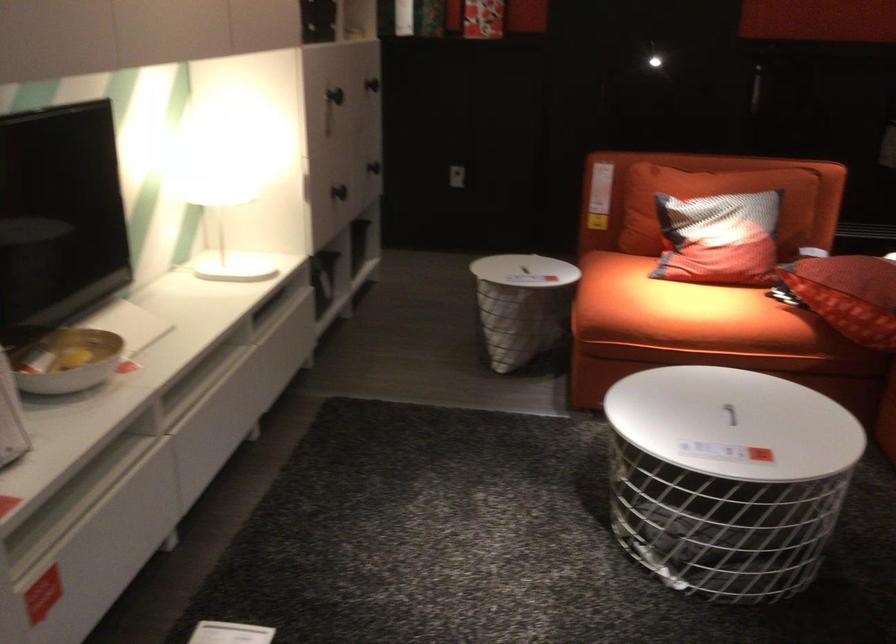
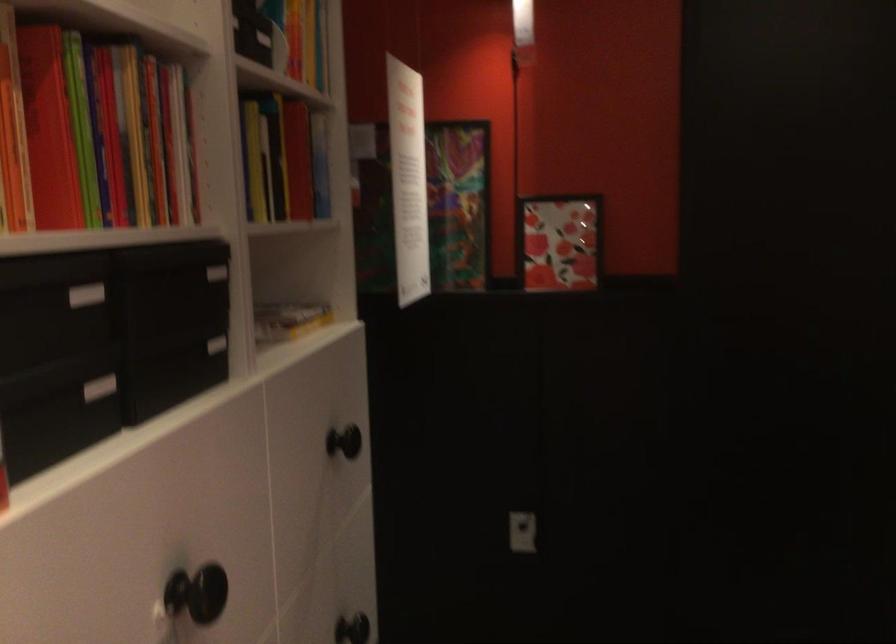
Find the pixel in the second image that matches (378,158) in the first image.

(351, 629)